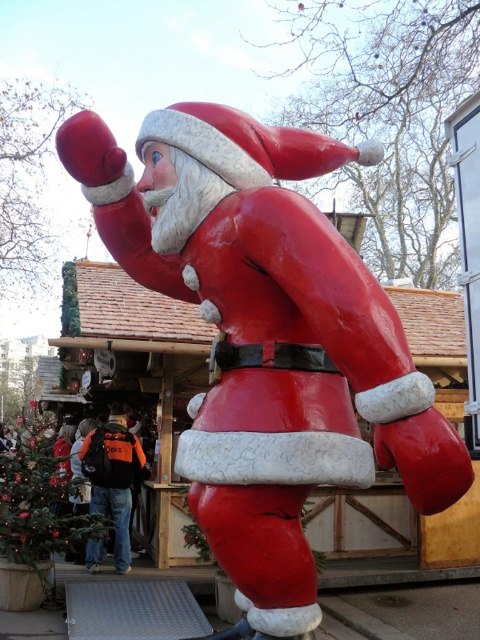
You are standing in front of the shiny plastic santa at center and the orange backpack at center. Which object would block your view more if you tried to look past them?

The shiny plastic santa at center is larger in size compared to the orange backpack at center, so it would block your view more when looking past them.